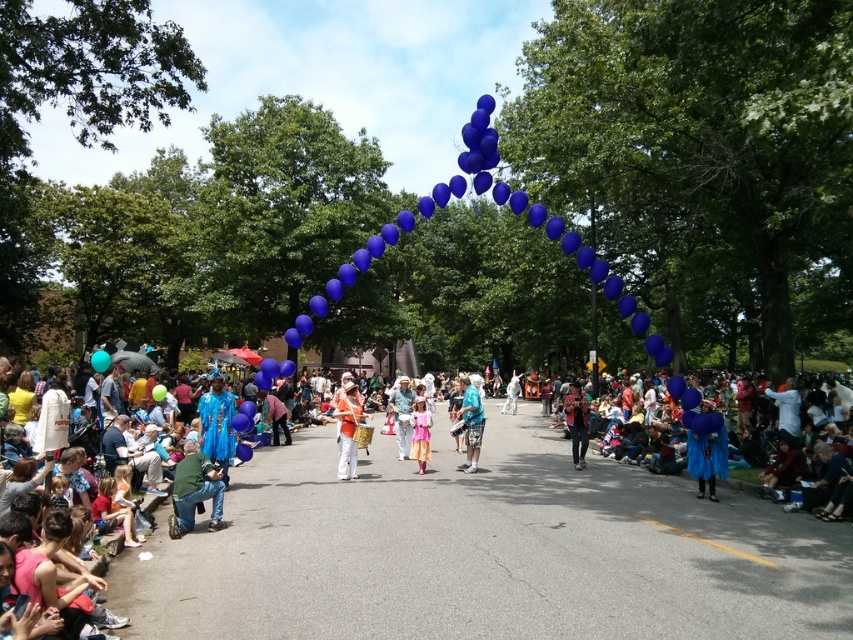
Question: Which point is closer to the camera?

Choices:
 (A) (843, 506)
 (B) (514, 413)
 (C) (556, 454)

Answer: (A)

Question: From the image, what is the correct spatial relationship of blue glossy balloons at center in relation to blue fabric crowd at right?

Choices:
 (A) above
 (B) below

Answer: (B)

Question: Is pink satin dress at center to the right of blue fabric balloon at center from the viewer's perspective?

Choices:
 (A) yes
 (B) no

Answer: (B)

Question: Is green denim jacket at lower left wider than blue fabric balloon at center?

Choices:
 (A) yes
 (B) no

Answer: (B)

Question: Which of the following is the closest to the observer?

Choices:
 (A) blue fabric skirt at center
 (B) blue fabric crowd at right
 (C) blue fabric shorts at center
 (D) matte orange drum at center

Answer: (B)

Question: Which point is closer to the camera?

Choices:
 (A) (515, 448)
 (B) (570, 422)
 (C) (480, 401)
 (D) (403, 385)

Answer: (C)